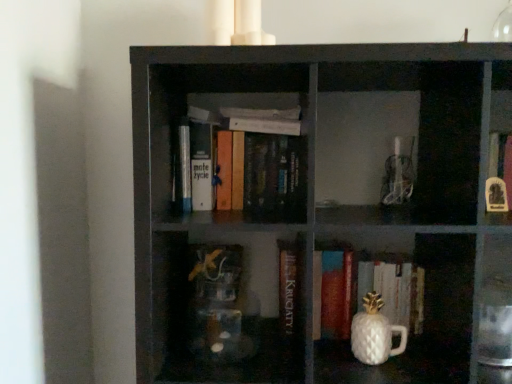
Question: Based on their sizes in the image, would you say white glossy pineapple-shaped object at lower center, acting as the 3th book starting from the left, is bigger or smaller than transparent glass vase at upper right?

Choices:
 (A) big
 (B) small

Answer: (A)

Question: Visually, is white glossy pineapple-shaped object at lower center, acting as the 3th book starting from the left, positioned to the left or to the right of transparent glass vase at upper right?

Choices:
 (A) right
 (B) left

Answer: (B)

Question: Which object is the farthest from the white glossy pineapple-shaped object at lower center, the 1th book viewed from the right?

Choices:
 (A) black matte bookshelf at center
 (B) hardcover books at center, the third book viewed from the right
 (C) hardcover book at center, placed as the second book when sorted from right to left
 (D) white knitted tea pot at lower right
 (E) transparent glass vase at upper right

Answer: (E)

Question: Which object is positioned closest to the hardcover books at center, the third book viewed from the right?

Choices:
 (A) black matte bookshelf at center
 (B) white knitted tea pot at lower right
 (C) hardcover book at center, placed as the second book when sorted from right to left
 (D) white glossy pineapple-shaped object at lower center, acting as the 3th book starting from the left
 (E) transparent glass vase at upper right

Answer: (A)